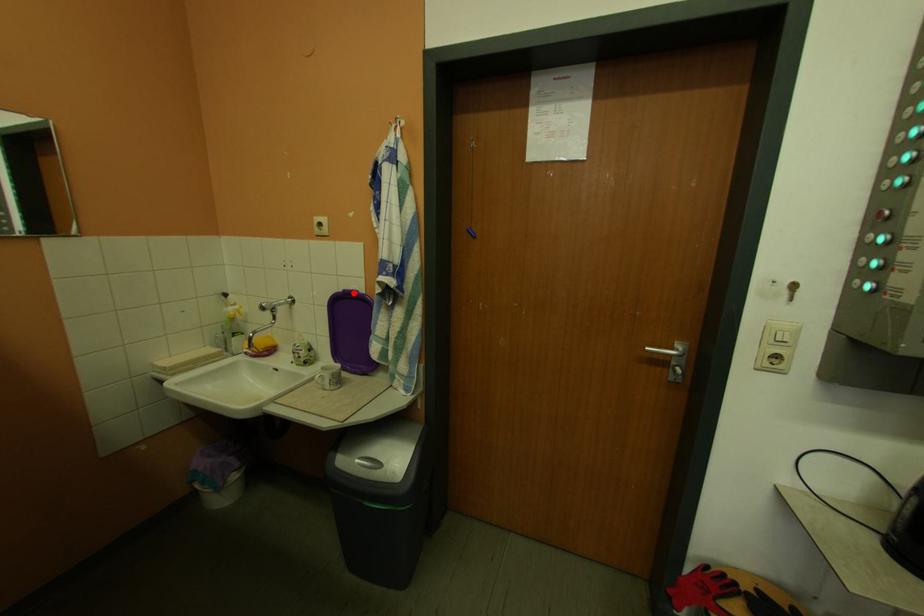
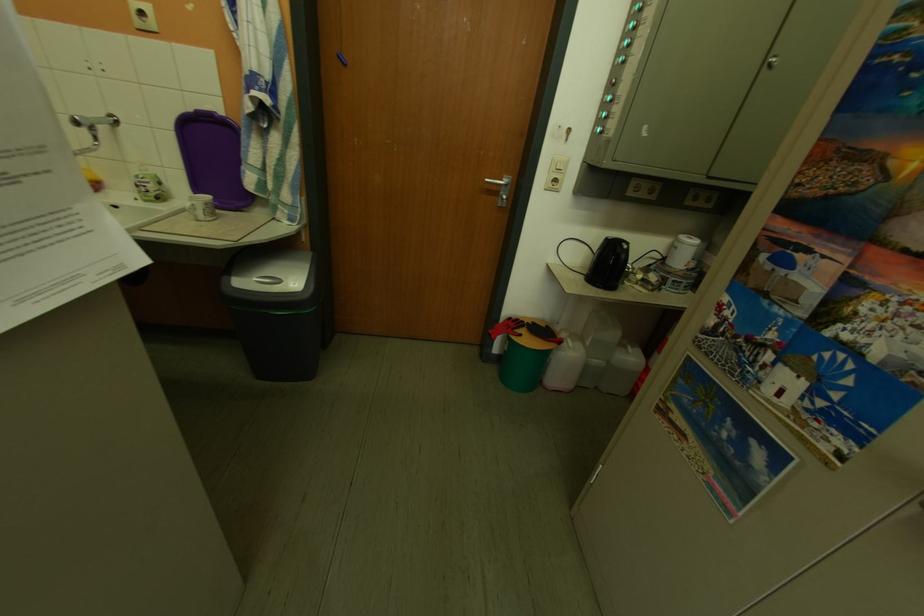
Find the pixel in the second image that matches the highlighted location in the first image.

(203, 113)